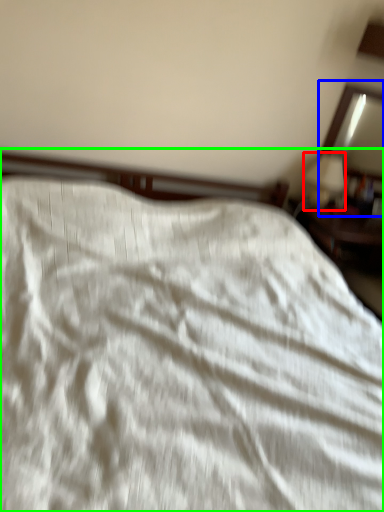
Question: Considering the real-world distances, which object is farthest from table lamp (highlighted by a red box)? mirror (highlighted by a blue box) or bed (highlighted by a green box)?

Choices:
 (A) mirror
 (B) bed

Answer: (B)